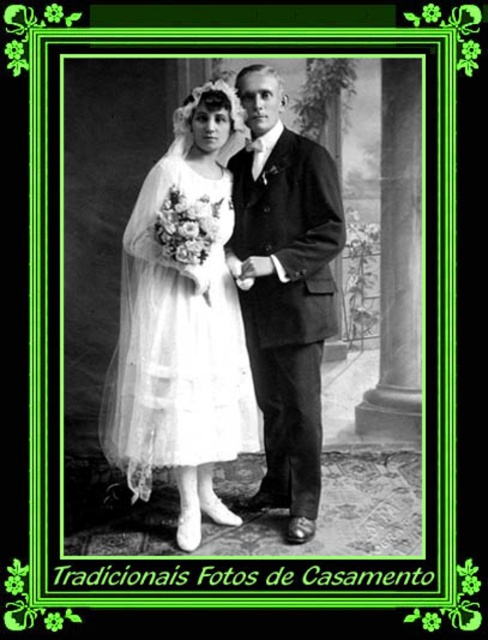
Based on the vintage wedding photograph described, which object is placed in front of the other between the white lace dress at center and the smooth black suit at center?

The white lace dress at center is positioned over smooth black suit at center, meaning it is in front.

You are an archivist examining the vintage wedding photograph. The photograph has a coordinate grid system where the bottom left corner is the origin point. You need to determine the position of the white lace dress at center. Can you confirm if the dress is positioned closer to the center of the image or near the edges?

The white lace dress at center is located at point coordinates approximately halfway between the edges, which means it is positioned near the center of the image.